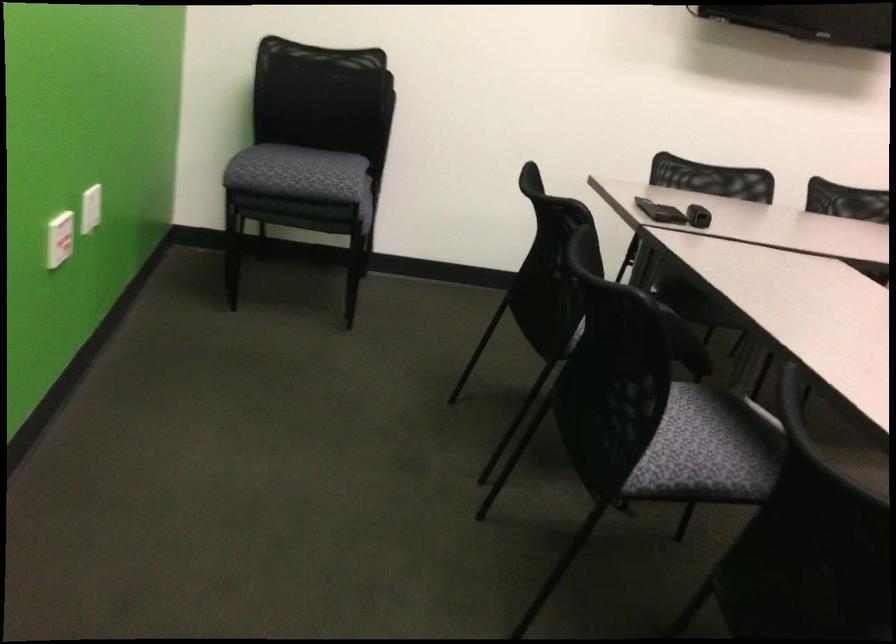
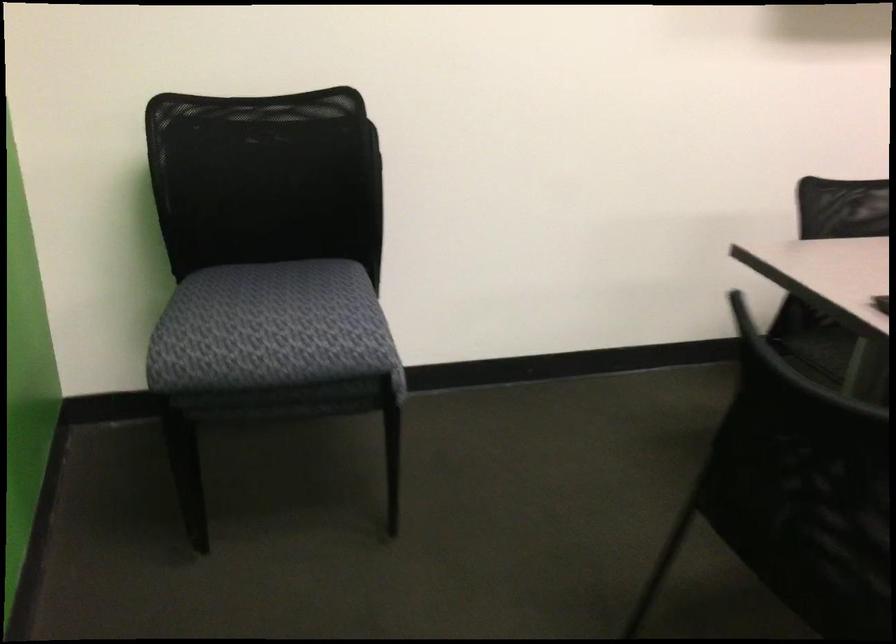
In the second image, find the point that corresponds to point 289,154 in the first image.

(271, 328)